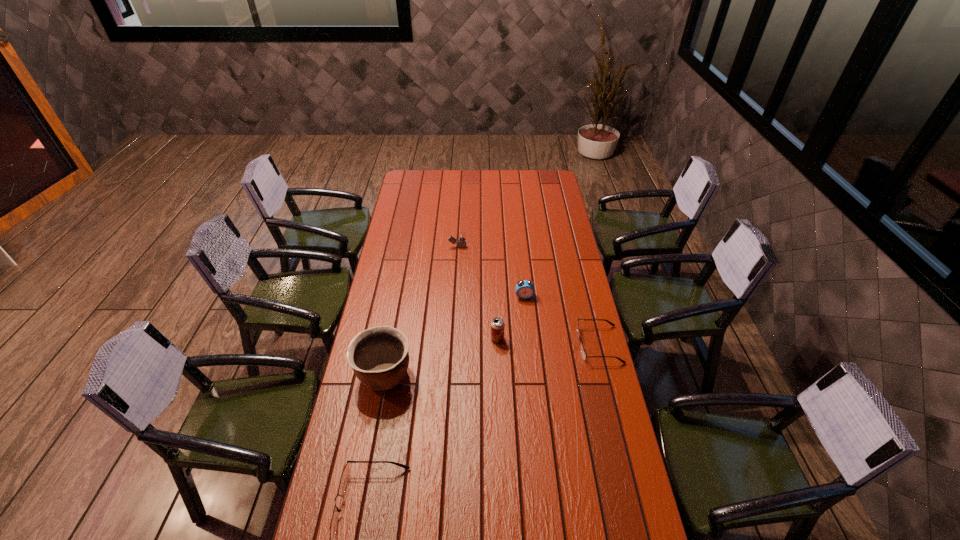
Locate an element on the screen. The width and height of the screenshot is (960, 540). vacant area located 0.390m on the front-facing side of the right spectacles is located at coordinates (478, 345).

You are a GUI agent. You are given a task and a screenshot of the screen. Output one action in this format:
    pyautogui.click(x=<x>, y=<y>)
    Task: Click on the vacant space situated 0.160m on the left of the igniter
    The image size is (960, 540).
    Given the screenshot: What is the action you would take?
    pyautogui.click(x=416, y=247)

The width and height of the screenshot is (960, 540). I want to click on free space located on the front of the pottery, so click(x=377, y=413).

Locate an element on the screen. vacant space located 0.320m on the face of the alarm clock is located at coordinates (531, 360).

This screenshot has height=540, width=960. In order to click on vacant point located on the right of the beer can in this screenshot , I will do `click(546, 339)`.

I want to click on object that is at the left edge, so click(x=379, y=357).

Image resolution: width=960 pixels, height=540 pixels. In order to click on object at the right edge in this screenshot , I will do tap(583, 353).

Identify the location of vacant space at the far edge of the desktop. This screenshot has height=540, width=960. (482, 191).

This screenshot has height=540, width=960. In order to click on vacant space at the left edge in this screenshot , I will do `click(375, 295)`.

This screenshot has height=540, width=960. Find the location of `free spot at the right edge of the desktop`. free spot at the right edge of the desktop is located at coordinates (607, 414).